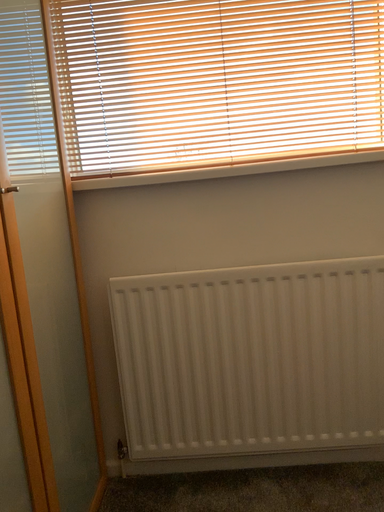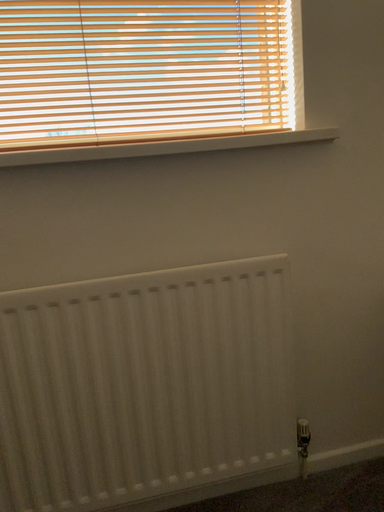
Question: How did the camera likely rotate when shooting the video?

Choices:
 (A) rotated left
 (B) rotated right

Answer: (B)